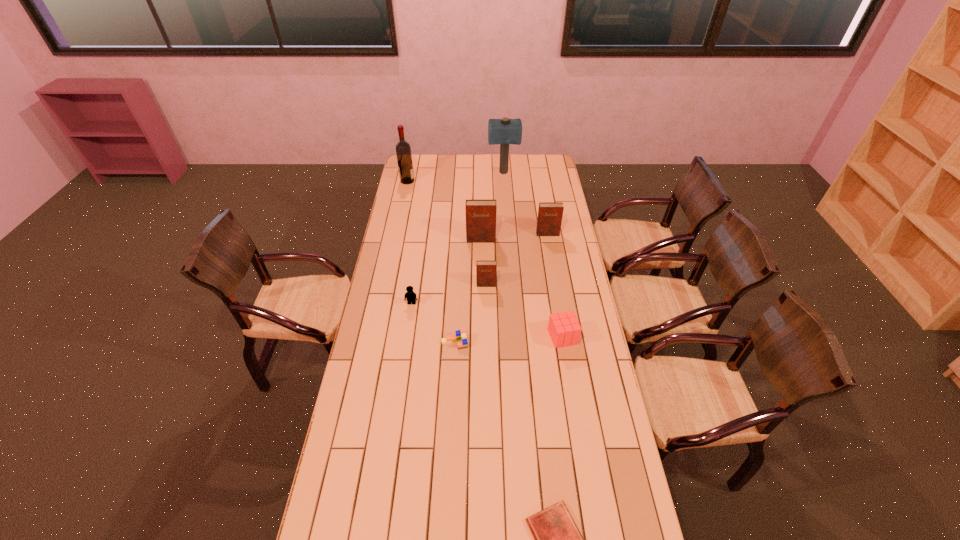
Where is `free space that satisfies the following two spatial constraints: 1. on the front-facing side of the farther Lego; 2. on the right side of the red cube`? free space that satisfies the following two spatial constraints: 1. on the front-facing side of the farther Lego; 2. on the right side of the red cube is located at coordinates (407, 337).

This screenshot has height=540, width=960. In order to click on vacant space that satisfies the following two spatial constraints: 1. on the front and back of the green alcohol; 2. on the right side of the shorter Lego in this screenshot , I will do `click(373, 343)`.